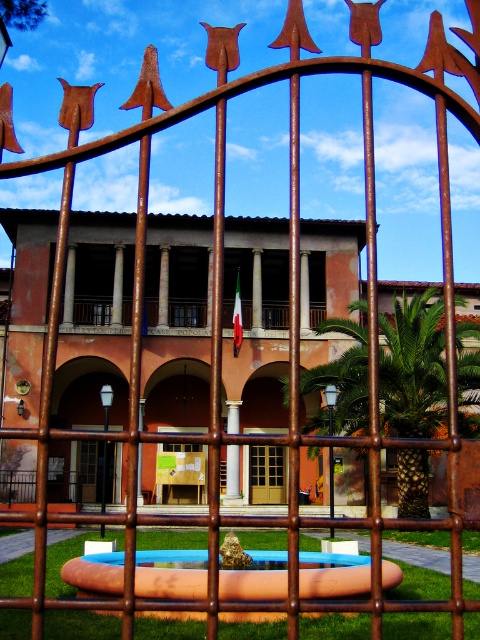
You are planning to place a new bench between the blue plastic pool at center and the brown polished stone pillar at center. Given their widths, which object should the bench be placed closer to to ensure it doesn

The blue plastic pool at center is wider than the brown polished stone pillar at center. To ensure the bench fits properly, it should be placed closer to the brown polished stone pillar at center since it has less width.

You are a delivery person trying to enter the building through the brown wooden door at center. The blue plastic pool at center is blocking your path. Can you walk around it to reach the door?

The blue plastic pool at center is above the brown wooden door at center, so you can walk around it to reach the door since it is elevated and not blocking the ground path.

You are standing outside the gate and want to walk towards the building. Which of the two points, point (88,582) or point (238,464), will you encounter first?

Point (88,582) is in front of point (238,464), so you will encounter point (88,582) first when walking towards the building.